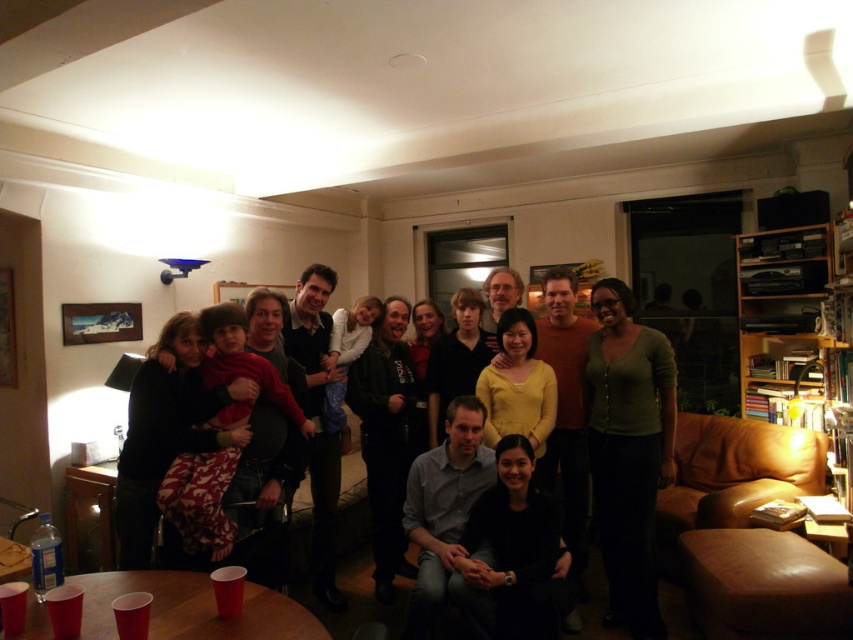
Question: Which point appears farthest from the camera in this image?

Choices:
 (A) (402, 451)
 (B) (323, 524)
 (C) (553, 394)
 (D) (465, 348)

Answer: (A)

Question: Is wooden bookshelf at upper right smaller than dark green sweater at center?

Choices:
 (A) no
 (B) yes

Answer: (A)

Question: Is dark brown hair at center to the right of black smooth shirt at center from the viewer's perspective?

Choices:
 (A) yes
 (B) no

Answer: (A)

Question: Where is matte black jacket at center located in relation to dark green sweater at center in the image?

Choices:
 (A) left
 (B) right

Answer: (B)

Question: Which point is closer to the camera?

Choices:
 (A) matte black shirt at center
 (B) dark green sweater at center
 (C) matte black jacket at center
 (D) wooden bookshelf at upper right

Answer: (C)

Question: Which point is farther from the camera taking this photo?

Choices:
 (A) (465, 339)
 (B) (618, 484)

Answer: (A)